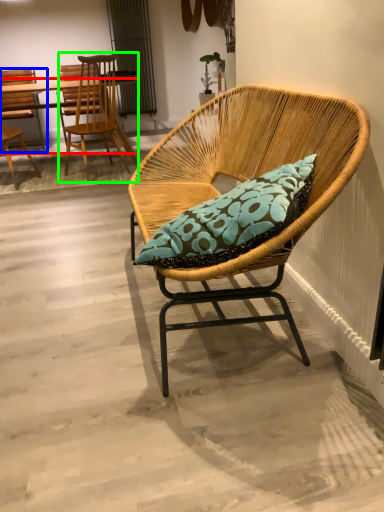
Question: Based on their relative distances, which object is farther from desk (highlighted by a red box)? Choose from chair (highlighted by a blue box) and chair (highlighted by a green box).

Choices:
 (A) chair
 (B) chair

Answer: (B)